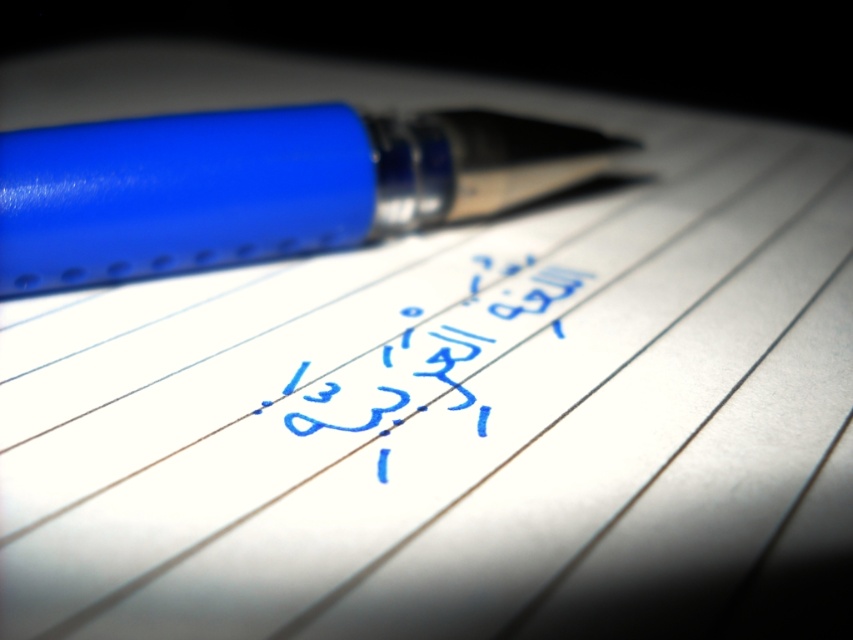
Question: Does matte blue pen at upper left have a greater width compared to blue ink writing at center?

Choices:
 (A) yes
 (B) no

Answer: (A)

Question: Is matte blue pen at upper left smaller than blue ink writing at center?

Choices:
 (A) yes
 (B) no

Answer: (B)

Question: Which of the following is the closest to the observer?

Choices:
 (A) click(376, 371)
 (B) click(381, 188)

Answer: (A)

Question: Which point is farther from the camera taking this photo?

Choices:
 (A) (432, 353)
 (B) (33, 269)

Answer: (B)

Question: Can you confirm if matte blue pen at upper left is bigger than blue ink writing at center?

Choices:
 (A) no
 (B) yes

Answer: (B)